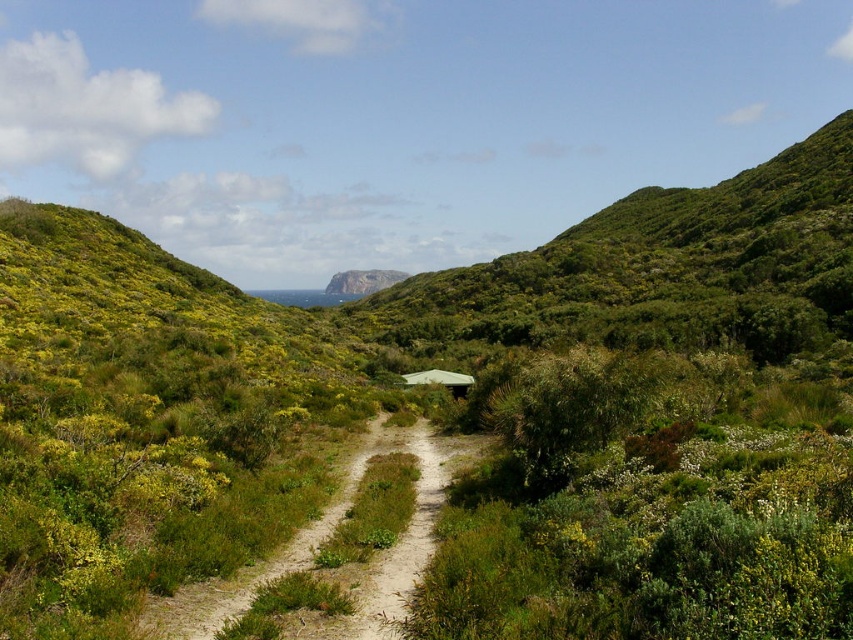
Based on the photo, you are a hiker standing at the starting point of the dirt path in the image. You want to reach the rugged stone mountain at center. According to the coordinates provided, what direction should you head towards from your current position?

The rugged stone mountain at center is located at coordinates point (x=363, y=282). Since you are at the starting point of the dirt path, which is likely in the foreground, you should head towards the center of the image to reach the rugged stone mountain at center.

You are planning to drive a car that is 2 meters wide along the path. Based on the scene, can the car fit on the brown sandy dirt track at center without touching the rugged stone mountain at center?

The brown sandy dirt track at center has a lesser width compared to rugged stone mountain at center. Since the car is 2 meters wide, it may not fit comfortably on the track if the track is narrower than 2 meters. However, the exact width of the track isn